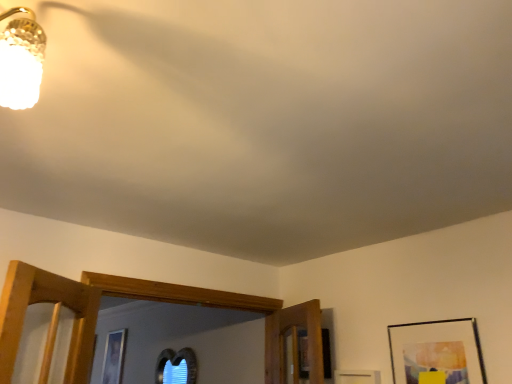
Find the location of a particular element. This screenshot has height=384, width=512. matte black picture frame at lower right is located at coordinates (437, 352).

The height and width of the screenshot is (384, 512). What do you see at coordinates (437, 352) in the screenshot?
I see `matte black picture frame at lower right` at bounding box center [437, 352].

Measure the distance between point (187, 370) and camera.

Point (187, 370) and camera are 3.42 meters apart.

Locate an element on the screen. This screenshot has height=384, width=512. smooth glass window at lower center is located at coordinates (176, 366).

In order to face smooth glass window at lower center, should I rotate leftwards or rightwards?

To face it directly, rotate left by 11.046 degrees.

Image resolution: width=512 pixels, height=384 pixels. What do you see at coordinates (176, 366) in the screenshot? I see `smooth glass window at lower center` at bounding box center [176, 366].

Where is `matte black picture frame at lower right`? The width and height of the screenshot is (512, 384). matte black picture frame at lower right is located at coordinates (437, 352).

Can you confirm if smooth glass window at lower center is positioned to the right of matte black picture frame at lower right?

Incorrect, smooth glass window at lower center is not on the right side of matte black picture frame at lower right.

Is smooth glass window at lower center further to the viewer compared to matte black picture frame at lower right?

Yes, smooth glass window at lower center is behind matte black picture frame at lower right.

Considering the points (169, 350) and (447, 344), which point is in front, point (169, 350) or point (447, 344)?

The point (447, 344) is closer.

From the image's perspective, between smooth glass window at lower center and matte black picture frame at lower right, who is located below?

smooth glass window at lower center, from the image's perspective.

From a real-world perspective, between smooth glass window at lower center and matte black picture frame at lower right, who is vertically lower?

In real-world perspective, smooth glass window at lower center is lower.

Based on the photo, which object is thinner, smooth glass window at lower center or matte black picture frame at lower right?

smooth glass window at lower center.

Which of these two, smooth glass window at lower center or matte black picture frame at lower right, stands taller?

Standing taller between the two is smooth glass window at lower center.

Who is smaller, smooth glass window at lower center or matte black picture frame at lower right?

matte black picture frame at lower right is smaller.

Could matte black picture frame at lower right be considered to be inside smooth glass window at lower center?

No, matte black picture frame at lower right is not a part of smooth glass window at lower center.

Is smooth glass window at lower center next to matte black picture frame at lower right and touching it?

smooth glass window at lower center and matte black picture frame at lower right are clearly separated.

Is smooth glass window at lower center facing away from matte black picture frame at lower right?

That's not correct — smooth glass window at lower center is not looking away from matte black picture frame at lower right.

How many degrees apart are the facing directions of smooth glass window at lower center and matte black picture frame at lower right?

0.442 degrees.

In the image, there is a matte black picture frame at lower right. Identify the location of picture below it (from a real-world perspective). (176, 366).

Can you confirm if matte black picture frame at lower right is positioned to the right of smooth glass window at lower center?

Indeed, matte black picture frame at lower right is positioned on the right side of smooth glass window at lower center.

Is matte black picture frame at lower right positioned before smooth glass window at lower center?

Yes, matte black picture frame at lower right is in front of smooth glass window at lower center.

Is point (395, 372) positioned behind point (163, 367)?

No, (395, 372) is in front of (163, 367).

From the image's perspective, between matte black picture frame at lower right and smooth glass window at lower center, who is located below?

From the image's view, smooth glass window at lower center is below.

From a real-world perspective, is matte black picture frame at lower right above or below smooth glass window at lower center?

Clearly, from a real-world perspective, matte black picture frame at lower right is above smooth glass window at lower center.

Can you confirm if matte black picture frame at lower right is thinner than smooth glass window at lower center?

Incorrect, the width of matte black picture frame at lower right is not less than that of smooth glass window at lower center.

Considering the relative sizes of matte black picture frame at lower right and smooth glass window at lower center in the image provided, is matte black picture frame at lower right shorter than smooth glass window at lower center?

Correct, matte black picture frame at lower right is not as tall as smooth glass window at lower center.

Looking at the image, does matte black picture frame at lower right seem bigger or smaller compared to smooth glass window at lower center?

In the image, matte black picture frame at lower right appears to be smaller than smooth glass window at lower center.

Is smooth glass window at lower center surrounded by matte black picture frame at lower right?

No, smooth glass window at lower center is not inside matte black picture frame at lower right.

Are matte black picture frame at lower right and smooth glass window at lower center beside each other?

matte black picture frame at lower right and smooth glass window at lower center are clearly separated.

Is matte black picture frame at lower right looking in the opposite direction of smooth glass window at lower center?

No, matte black picture frame at lower right is not facing away from smooth glass window at lower center.

Locate an element on the screen. picture below the matte black picture frame at lower right (from a real-world perspective) is located at coordinates (176, 366).

In order to click on picture frame in front of the smooth glass window at lower center in this screenshot , I will do `click(437, 352)`.

You are a GUI agent. You are given a task and a screenshot of the screen. Output one action in this format:
    pyautogui.click(x=<x>, y=<y>)
    Task: Click on the picture that appears on the left of matte black picture frame at lower right
    
    Given the screenshot: What is the action you would take?
    pyautogui.click(x=176, y=366)